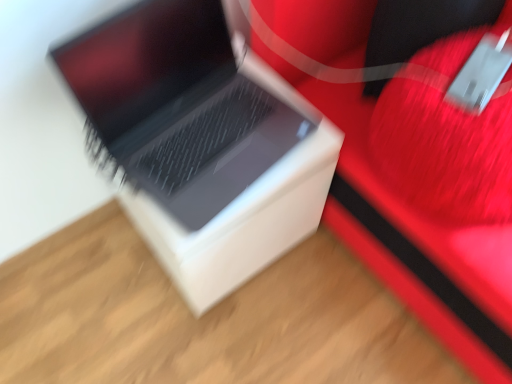
Question: Is there a large distance between rubberized red suitcase at center and white matte cardboard box at center?

Choices:
 (A) no
 (B) yes

Answer: (A)

Question: Is rubberized red suitcase at center looking in the opposite direction of white matte cardboard box at center?

Choices:
 (A) no
 (B) yes

Answer: (A)

Question: Does rubberized red suitcase at center turn towards white matte cardboard box at center?

Choices:
 (A) yes
 (B) no

Answer: (B)

Question: Considering the relative sizes of rubberized red suitcase at center and white matte cardboard box at center in the image provided, is rubberized red suitcase at center taller than white matte cardboard box at center?

Choices:
 (A) yes
 (B) no

Answer: (A)

Question: From the image's perspective, would you say rubberized red suitcase at center is positioned over white matte cardboard box at center?

Choices:
 (A) no
 (B) yes

Answer: (B)

Question: In the image, is sleek silver laptop at center positioned in front of or behind white matte cardboard box at center?

Choices:
 (A) behind
 (B) front

Answer: (B)

Question: Is sleek silver laptop at center to the left or to the right of white matte cardboard box at center in the image?

Choices:
 (A) right
 (B) left

Answer: (A)

Question: From the image's perspective, is sleek silver laptop at center above or below white matte cardboard box at center?

Choices:
 (A) below
 (B) above

Answer: (B)

Question: From a real-world perspective, is sleek silver laptop at center physically located above or below white matte cardboard box at center?

Choices:
 (A) below
 (B) above

Answer: (B)

Question: Considering their positions, is rubberized red suitcase at center located in front of or behind white matte cardboard box at center?

Choices:
 (A) behind
 (B) front

Answer: (B)

Question: Does point (441, 329) appear closer or farther from the camera than point (227, 289)?

Choices:
 (A) farther
 (B) closer

Answer: (B)

Question: In the image, is rubberized red suitcase at center on the left side or the right side of white matte cardboard box at center?

Choices:
 (A) right
 (B) left

Answer: (A)

Question: From the image's perspective, is rubberized red suitcase at center located above or below white matte cardboard box at center?

Choices:
 (A) below
 (B) above

Answer: (B)

Question: Looking at the image, does white matte cardboard box at center seem bigger or smaller compared to rubberized red suitcase at center?

Choices:
 (A) big
 (B) small

Answer: (B)

Question: Is point (315, 157) positioned closer to the camera than point (397, 160)?

Choices:
 (A) closer
 (B) farther

Answer: (B)